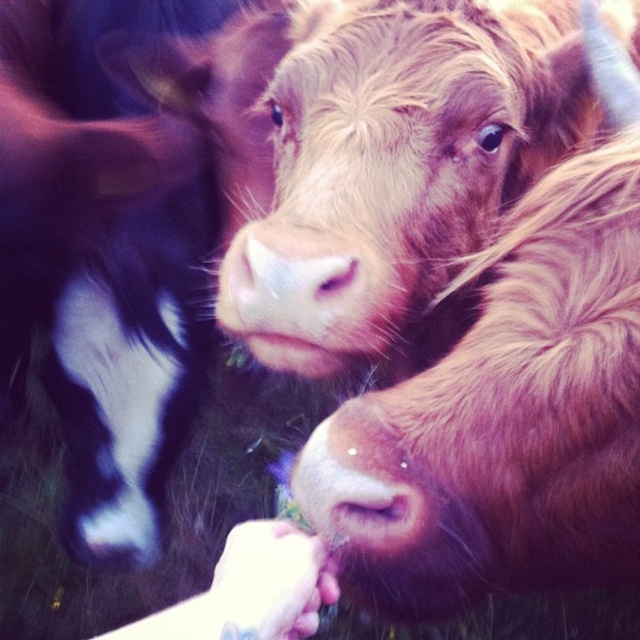
Is black and white fur at left bigger than brown furry cow at center?

Yes.

Is black and white fur at left further to the viewer compared to brown furry cow at center?

That is True.

Which is behind, point (147, 554) or point (362, 124)?

Positioned behind is point (147, 554).

I want to click on black and white fur at left, so click(x=124, y=230).

Can you confirm if black and white fur at left is smaller than pink soft fur nose at center?

Actually, black and white fur at left might be larger than pink soft fur nose at center.

Is black and white fur at left in front of pink soft fur nose at center?

No, black and white fur at left is behind pink soft fur nose at center.

What do you see at coordinates (124, 230) in the screenshot? I see `black and white fur at left` at bounding box center [124, 230].

You are a GUI agent. You are given a task and a screenshot of the screen. Output one action in this format:
    pyautogui.click(x=<x>, y=<y>)
    Task: Click on the black and white fur at left
    
    Given the screenshot: What is the action you would take?
    pyautogui.click(x=124, y=230)

In the scene shown: Who is shorter, brown furry cow at center or pink soft fur nose at center?

pink soft fur nose at center

Does brown furry cow at center appear on the right side of pink soft fur nose at center?

Yes, brown furry cow at center is to the right of pink soft fur nose at center.

Describe the element at coordinates (394, 163) in the screenshot. I see `brown furry cow at center` at that location.

The height and width of the screenshot is (640, 640). I want to click on brown furry cow at center, so click(394, 163).